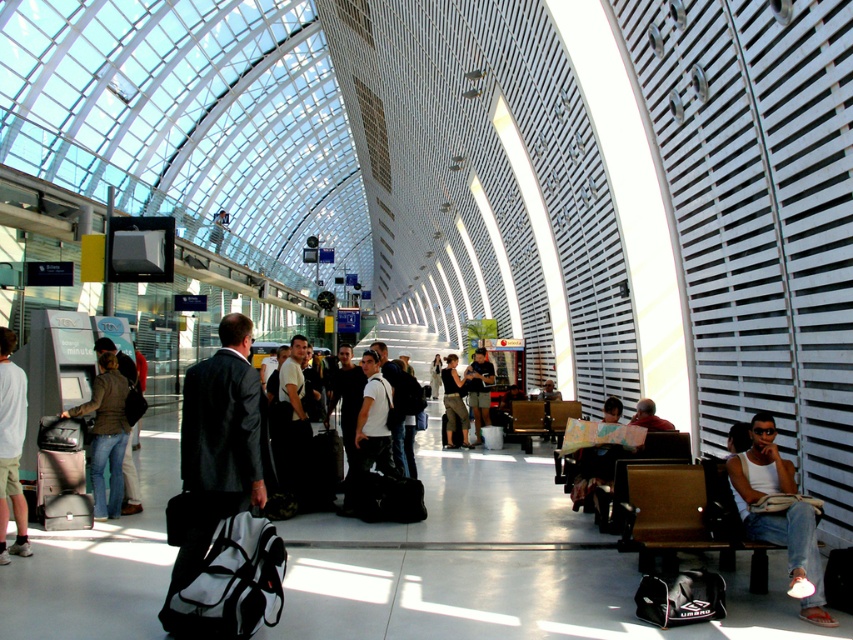
Question: Which is farther from the matte black suitcase at lower left?

Choices:
 (A) matte white map at center
 (B) denim jacket at left
 (C) black matte suit at center
 (D) white cotton shirt at center

Answer: (A)

Question: Estimate the real-world distances between objects in this image. Which object is farther from the dark gray suit at center?

Choices:
 (A) white cotton tank top at center right
 (B) white cotton shirt at center
 (C) black matte suit at center
 (D) denim jacket at left

Answer: (C)

Question: Is matte white map at center further to the viewer compared to dark gray suit at center?

Choices:
 (A) no
 (B) yes

Answer: (A)

Question: Can you confirm if black matte suit at center is positioned above dark gray fabric jacket at center?

Choices:
 (A) yes
 (B) no

Answer: (A)

Question: Does black matte suit at center come behind dark gray suit at center?

Choices:
 (A) yes
 (B) no

Answer: (B)

Question: Which object is positioned closest to the white cotton tank top at center right?

Choices:
 (A) matte black suitcase at lower left
 (B) dark gray suit at center

Answer: (A)